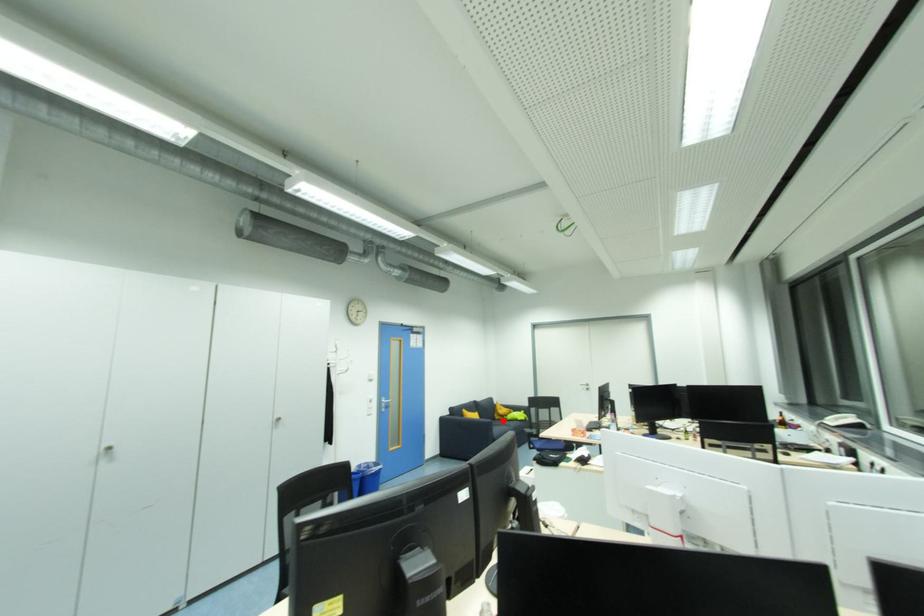
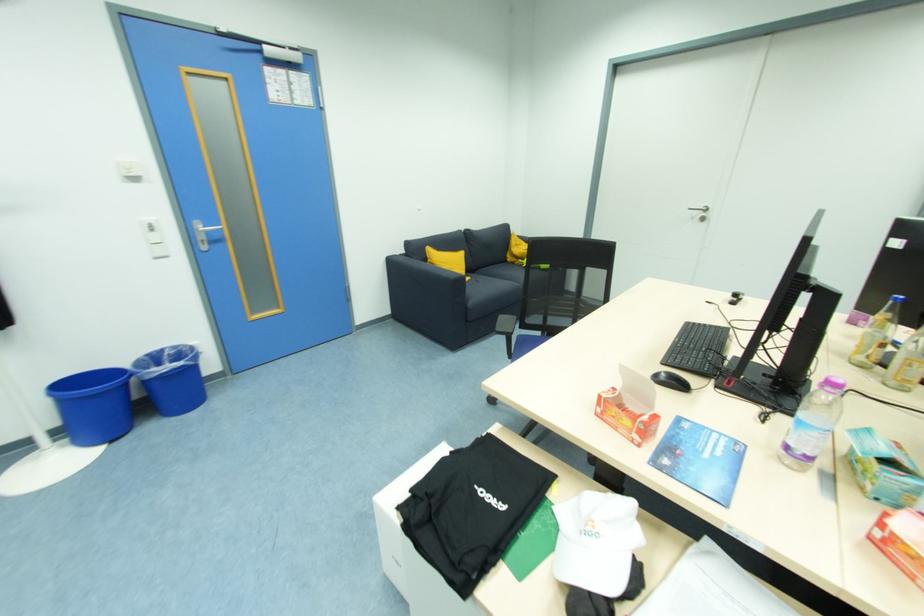
Find the pixel in the second image that matches the highlighted location in the first image.

(516, 265)